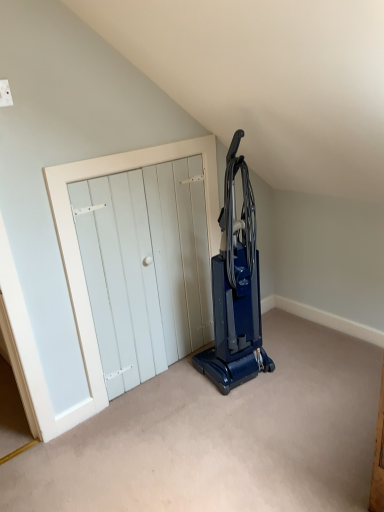
You are a GUI agent. You are given a task and a screenshot of the screen. Output one action in this format:
    pyautogui.click(x=<x>, y=<y>)
    Task: Click on the free space in front of blue plastic vacuum cleaner at center
    
    Given the screenshot: What is the action you would take?
    [x=246, y=408]